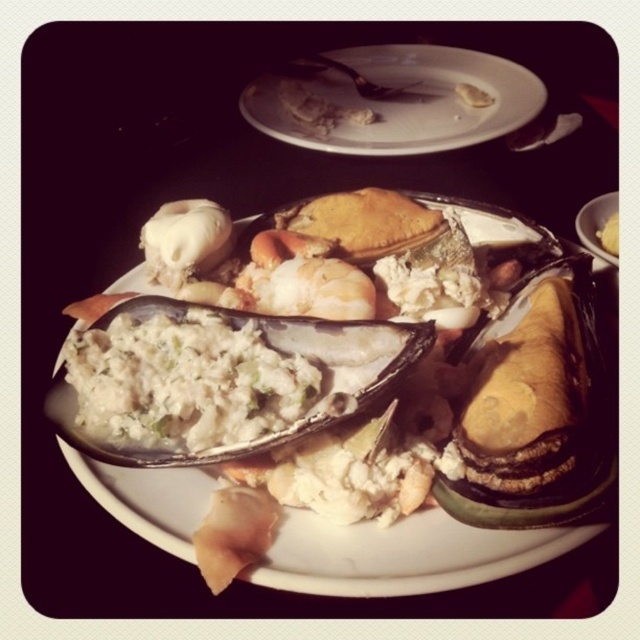
Question: From the image, what is the correct spatial relationship of white creamy seafood at center in relation to white creamy oyster at center?

Choices:
 (A) right
 (B) left

Answer: (A)

Question: Is white creamy oyster at center positioned before yellow matte bread at center?

Choices:
 (A) yes
 (B) no

Answer: (A)

Question: Which point is farther to the camera?

Choices:
 (A) (515, 99)
 (B) (614, 244)
 (C) (426, 589)

Answer: (A)

Question: Among these points, which one is farthest from the camera?

Choices:
 (A) (500, 100)
 (B) (353, 346)
 (C) (616, 218)

Answer: (A)

Question: Where is white creamy seafood at center located in relation to white porcelain plate at upper center in the image?

Choices:
 (A) right
 (B) left

Answer: (B)

Question: Among these points, which one is farthest from the camera?

Choices:
 (A) (614, 214)
 (B) (362, 588)
 (C) (356, 102)

Answer: (C)